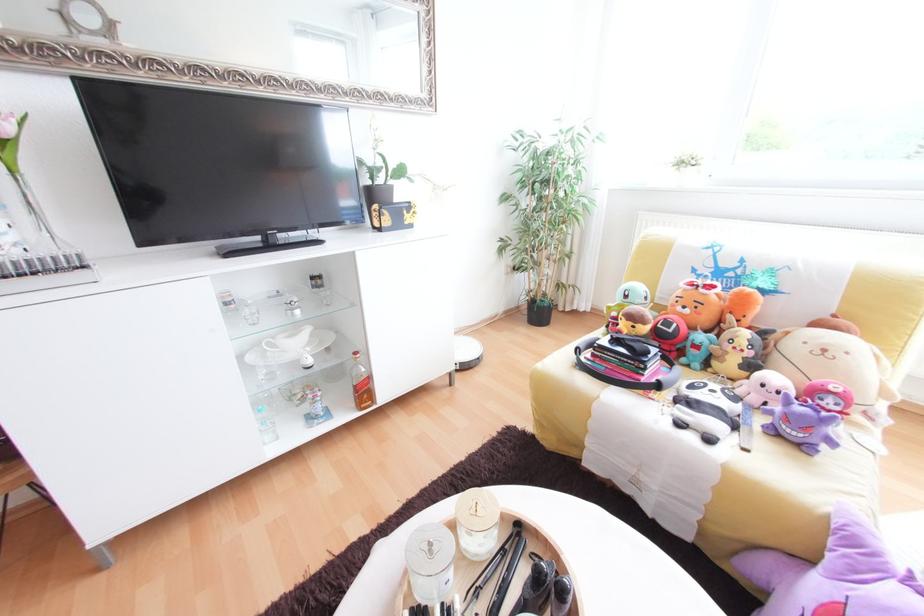
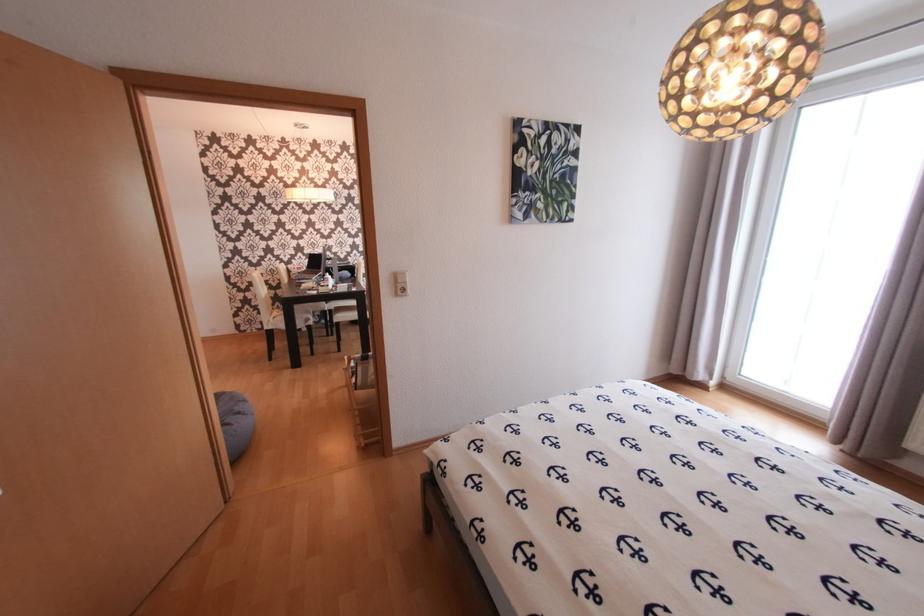
Question: In a continuous first-person perspective shot, in which direction is the camera moving?

Choices:
 (A) Left
 (B) Right
 (C) Forward
 (D) Backward

Answer: (D)